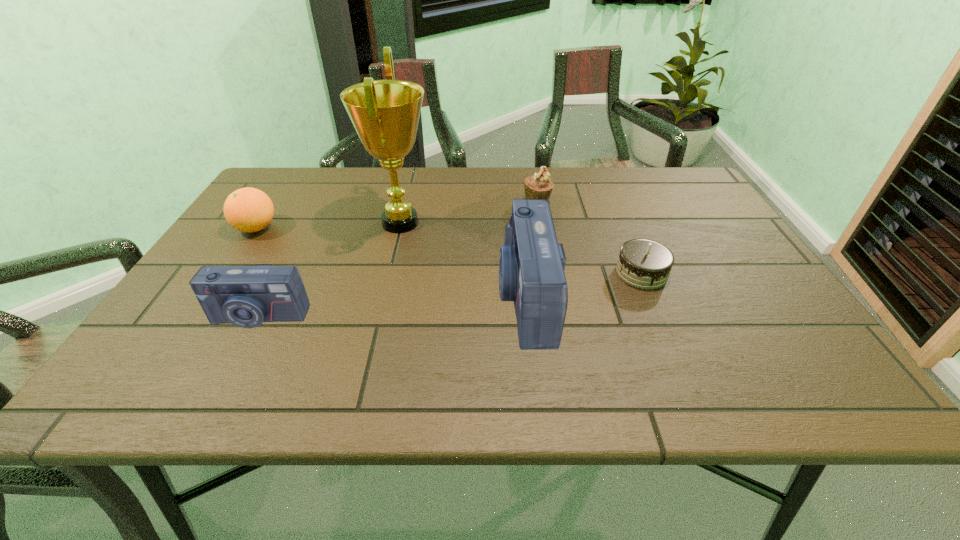
With all cameras evenly spaced, where should an extra camera be placed on the right to continue the pattern? Please point out a vacant space. Please provide its 2D coordinates. Your answer should be formatted as a tuple, i.e. [(x, y)], where the tuple contains the x and y coordinates of a point satisfying the conditions above.

[(770, 279)]